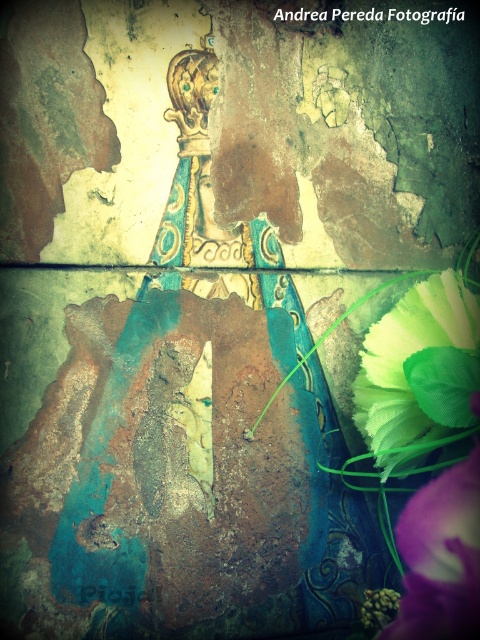
Question: Can you confirm if translucent yellow-green fabric at lower right is positioned to the right of purple matte flower at lower right?

Choices:
 (A) yes
 (B) no

Answer: (B)

Question: Which object appears farthest from the camera in this image?

Choices:
 (A) purple matte flower at lower right
 (B) translucent yellow-green fabric at lower right

Answer: (A)

Question: Does translucent yellow-green fabric at lower right appear under purple matte flower at lower right?

Choices:
 (A) yes
 (B) no

Answer: (B)

Question: Among these objects, which one is farthest from the camera?

Choices:
 (A) purple matte flower at lower right
 (B) translucent yellow-green fabric at lower right

Answer: (A)

Question: Is translucent yellow-green fabric at lower right positioned before purple matte flower at lower right?

Choices:
 (A) yes
 (B) no

Answer: (A)

Question: Which point is farther to the camera?

Choices:
 (A) purple matte flower at lower right
 (B) translucent yellow-green fabric at lower right

Answer: (A)